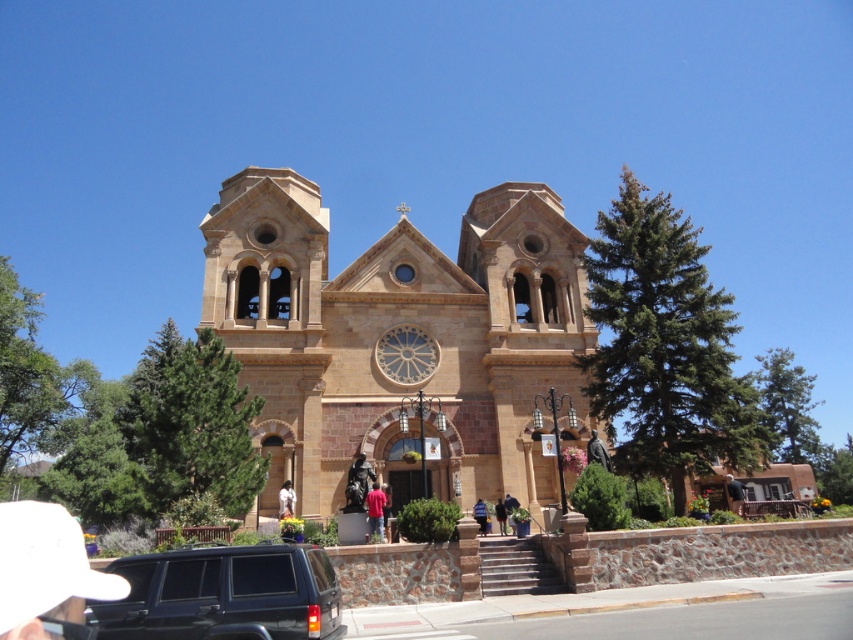
Can you confirm if dark blue jeans at lower center is bigger than reddish-brown fabric pants at center?

No, dark blue jeans at lower center is not bigger than reddish-brown fabric pants at center.

Consider the image. Does dark blue jeans at lower center appear under reddish-brown fabric pants at center?

Incorrect, dark blue jeans at lower center is not positioned below reddish-brown fabric pants at center.

Between point (505, 508) and point (503, 516), which one is positioned behind?

The point (505, 508) is more distant.

At what (x,y) coordinates should I click in order to perform the action: click on dark blue jeans at lower center. Please return your answer as a coordinate pair (x, y). The height and width of the screenshot is (640, 853). Looking at the image, I should click on (509, 508).

Which is more to the left, white fabric cap at lower left or red cotton shirt at center?

white fabric cap at lower left is more to the left.

Can you confirm if white fabric cap at lower left is smaller than red cotton shirt at center?

No, white fabric cap at lower left is not smaller than red cotton shirt at center.

Image resolution: width=853 pixels, height=640 pixels. Find the location of `white fabric cap at lower left`. white fabric cap at lower left is located at coordinates (45, 570).

Does black matte suv at lower left lie in front of reddish-brown fabric pants at center?

That is True.

Between point (126, 637) and point (503, 513), which one is positioned in front?

Point (126, 637) is in front.

The width and height of the screenshot is (853, 640). Find the location of `black matte suv at lower left`. black matte suv at lower left is located at coordinates (223, 595).